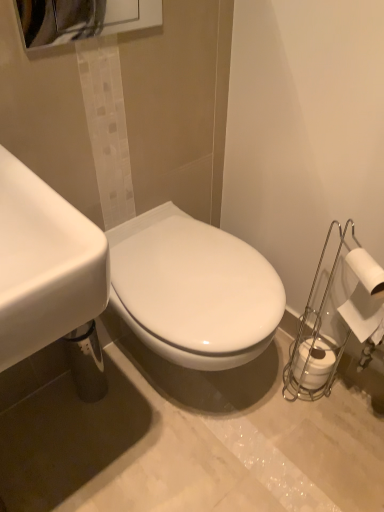
This screenshot has width=384, height=512. What do you see at coordinates (314, 362) in the screenshot?
I see `white matte toilet paper at lower right, marked as the first toilet paper in a back-to-front arrangement` at bounding box center [314, 362].

Based on the photo, how much space does white matte toilet paper at right, the 2th toilet paper positioned from the back, occupy horizontally?

white matte toilet paper at right, the 2th toilet paper positioned from the back, is 3.00 inches wide.

Measure the distance between point (378,293) and camera.

The depth of point (378,293) is 34.49 inches.

What is the approximate width of white glossy sink at left?

It is 1.80 inches.

Identify the location of white matte toilet paper at lower right, which is the second toilet paper from front to back. The height and width of the screenshot is (512, 384). (314, 362).

Which is more to the left, white glossy sink at left or white matte toilet paper at lower right, marked as the first toilet paper in a back-to-front arrangement?

white glossy sink at left.

From a real-world perspective, is white glossy sink at left above or below white matte toilet paper at lower right, placed as the 1th toilet paper when sorted from bottom to top?

white glossy sink at left is situated higher than white matte toilet paper at lower right, placed as the 1th toilet paper when sorted from bottom to top, in the real world.

Considering the sizes of objects white glossy sink at left and white matte toilet paper at lower right, which is the second toilet paper from front to back, in the image provided, who is smaller, white glossy sink at left or white matte toilet paper at lower right, which is the second toilet paper from front to back,?

Smaller between the two is white matte toilet paper at lower right, which is the second toilet paper from front to back.

Which object is closer to the camera, white glossy sink at left or white matte toilet paper at lower right, which is the second toilet paper from front to back?

white glossy sink at left is in front.

Between white glossy sink at left and white matte toilet paper at right, the second toilet paper in the bottom-to-top sequence, which one has smaller width?

Thinner between the two is white glossy sink at left.

Could you measure the distance between white glossy sink at left and white matte toilet paper at right, the 2th toilet paper positioned from the back?

white glossy sink at left and white matte toilet paper at right, the 2th toilet paper positioned from the back, are 31.01 centimeters apart from each other.

Which is further, (x=38, y=213) or (x=357, y=300)?

Positioned behind is point (x=357, y=300).

Do you think white matte toilet paper at lower right, marked as the first toilet paper in a back-to-front arrangement, is within white matte toilet paper at right, the 1th toilet paper positioned from the front, or outside of it?

white matte toilet paper at lower right, marked as the first toilet paper in a back-to-front arrangement, is not inside white matte toilet paper at right, the 1th toilet paper positioned from the front, it's outside.

In terms of size, does white matte toilet paper at lower right, arranged as the second toilet paper when viewed from the top, appear bigger or smaller than white matte toilet paper at right, the second toilet paper in the bottom-to-top sequence?

white matte toilet paper at lower right, arranged as the second toilet paper when viewed from the top, is smaller than white matte toilet paper at right, the second toilet paper in the bottom-to-top sequence.

Does white matte toilet paper at lower right, arranged as the second toilet paper when viewed from the top, have a lesser height compared to white matte toilet paper at right, the 1th toilet paper positioned from the front?

Yes, white matte toilet paper at lower right, arranged as the second toilet paper when viewed from the top, is shorter than white matte toilet paper at right, the 1th toilet paper positioned from the front.

Which is behind, white matte toilet paper at lower right, marked as the first toilet paper in a back-to-front arrangement, or white matte toilet paper at right, the 1th toilet paper positioned from the top?

white matte toilet paper at lower right, marked as the first toilet paper in a back-to-front arrangement, is more distant.

Is point (306, 343) positioned after point (58, 211)?

Yes, it is behind point (58, 211).

Is white matte toilet paper at lower right, placed as the 1th toilet paper when sorted from bottom to top, smaller than white glossy sink at left?

Yes, white matte toilet paper at lower right, placed as the 1th toilet paper when sorted from bottom to top, is smaller than white glossy sink at left.

Based on the photo, from a real-world perspective, is white matte toilet paper at lower right, arranged as the second toilet paper when viewed from the top, positioned over white glossy sink at left based on gravity?

Incorrect, from a real-world perspective, white matte toilet paper at lower right, arranged as the second toilet paper when viewed from the top, is lower than white glossy sink at left.

Which object is positioned more to the right, white matte toilet paper at right, the second toilet paper in the bottom-to-top sequence, or white matte toilet paper at lower right, marked as the first toilet paper in a back-to-front arrangement?

Positioned to the right is white matte toilet paper at right, the second toilet paper in the bottom-to-top sequence.

Does white matte toilet paper at right, the 1th toilet paper positioned from the top, have a smaller size compared to white matte toilet paper at lower right, arranged as the second toilet paper when viewed from the top?

Actually, white matte toilet paper at right, the 1th toilet paper positioned from the top, might be larger than white matte toilet paper at lower right, arranged as the second toilet paper when viewed from the top.

Is white matte toilet paper at right, the 1th toilet paper positioned from the top, turned away from white matte toilet paper at lower right, arranged as the second toilet paper when viewed from the top?

white matte toilet paper at right, the 1th toilet paper positioned from the top, does not have its back to white matte toilet paper at lower right, arranged as the second toilet paper when viewed from the top.

Would you say white matte toilet paper at right, the 2th toilet paper positioned from the back, is outside white matte toilet paper at lower right, arranged as the second toilet paper when viewed from the top?

That's correct, white matte toilet paper at right, the 2th toilet paper positioned from the back, is outside of white matte toilet paper at lower right, arranged as the second toilet paper when viewed from the top.

How much distance is there between white matte toilet paper at right, the 2th toilet paper positioned from the back, and white glossy sink at left?

white matte toilet paper at right, the 2th toilet paper positioned from the back, and white glossy sink at left are 12.21 inches apart from each other.

Can you confirm if white matte toilet paper at right, the 1th toilet paper positioned from the front, is thinner than white glossy sink at left?

No.

From the image's perspective, is white matte toilet paper at right, the 1th toilet paper positioned from the front, positioned above or below white glossy sink at left?

From the image's perspective, white matte toilet paper at right, the 1th toilet paper positioned from the front, appears below white glossy sink at left.

How different are the orientations of white matte toilet paper at right, the 1th toilet paper positioned from the front, and white glossy sink at left in degrees?

They differ by 116 degrees in their facing directions.

Locate an element on the screen. Image resolution: width=384 pixels, height=512 pixels. sink above the white matte toilet paper at lower right, arranged as the second toilet paper when viewed from the top (from the image's perspective) is located at coordinates (121, 279).

From the image's perspective, starting from the white glossy sink at left, which toilet paper is the 1st one below? Please provide its 2D coordinates.

[(364, 295)]

From the image, which object appears to be nearer to white matte toilet paper at lower right, arranged as the second toilet paper when viewed from the top, white glossy sink at left or white matte toilet paper at right, the second toilet paper in the bottom-to-top sequence?

white matte toilet paper at right, the second toilet paper in the bottom-to-top sequence, lies closer to white matte toilet paper at lower right, arranged as the second toilet paper when viewed from the top, than the other object.

From the picture: When comparing their distances from white glossy sink at left, does white matte toilet paper at right, the second toilet paper in the bottom-to-top sequence, or white matte toilet paper at lower right, arranged as the second toilet paper when viewed from the top, seem further?

white matte toilet paper at lower right, arranged as the second toilet paper when viewed from the top.

Considering their positions, is white matte toilet paper at lower right, marked as the first toilet paper in a back-to-front arrangement, positioned further to white glossy sink at left than white matte toilet paper at right, the 2th toilet paper positioned from the back?

white matte toilet paper at lower right, marked as the first toilet paper in a back-to-front arrangement.

When comparing their distances from white matte toilet paper at right, the 1th toilet paper positioned from the top, does white glossy sink at left or white matte toilet paper at lower right, placed as the 1th toilet paper when sorted from bottom to top, seem further?

white glossy sink at left is positioned further to the anchor white matte toilet paper at right, the 1th toilet paper positioned from the top.

Based on their spatial positions, is white matte toilet paper at lower right, marked as the first toilet paper in a back-to-front arrangement, or white glossy sink at left closer to white matte toilet paper at right, the second toilet paper in the bottom-to-top sequence?

white matte toilet paper at lower right, marked as the first toilet paper in a back-to-front arrangement, is positioned closer to the anchor white matte toilet paper at right, the second toilet paper in the bottom-to-top sequence.

When comparing their distances from white matte toilet paper at lower right, marked as the first toilet paper in a back-to-front arrangement, does white matte toilet paper at right, the second toilet paper in the bottom-to-top sequence, or white glossy sink at left seem closer?

The object closer to white matte toilet paper at lower right, marked as the first toilet paper in a back-to-front arrangement, is white matte toilet paper at right, the second toilet paper in the bottom-to-top sequence.

The width and height of the screenshot is (384, 512). I want to click on toilet paper between white glossy sink at left and white matte toilet paper at right, the second toilet paper in the bottom-to-top sequence, in the horizontal direction, so click(x=314, y=362).